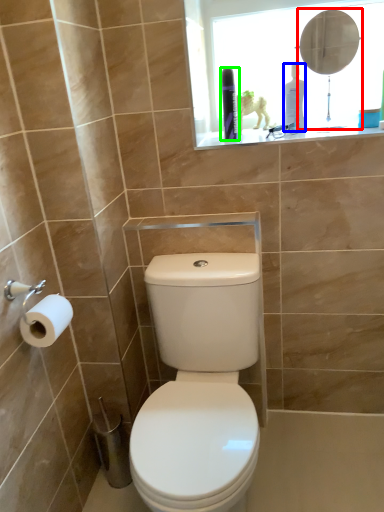
Question: Which object is positioned farthest from mirror (highlighted by a red box)? Select from toiletry (highlighted by a blue box) and toiletry (highlighted by a green box).

Choices:
 (A) toiletry
 (B) toiletry

Answer: (B)